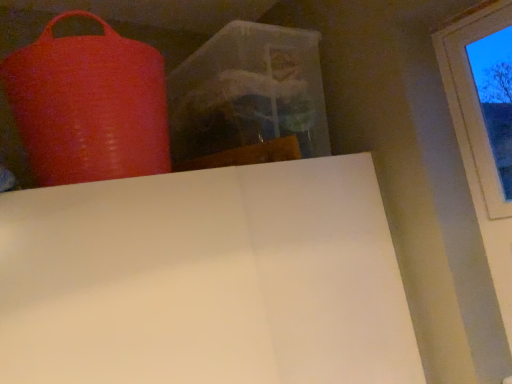
Where is `transparent glass window at upper right`? This screenshot has height=384, width=512. transparent glass window at upper right is located at coordinates (473, 99).

What do you see at coordinates (473, 99) in the screenshot?
I see `transparent glass window at upper right` at bounding box center [473, 99].

You are a GUI agent. You are given a task and a screenshot of the screen. Output one action in this format:
    pyautogui.click(x=<x>, y=<y>)
    Task: Click on the rubberized red punching bag at upper left
    Image resolution: width=512 pixels, height=384 pixels.
    Given the screenshot: What is the action you would take?
    pyautogui.click(x=89, y=105)

This screenshot has height=384, width=512. What do you see at coordinates (89, 105) in the screenshot?
I see `rubberized red punching bag at upper left` at bounding box center [89, 105].

In order to face rubberized red punching bag at upper left, should I rotate leftwards or rightwards?

Rotate your view left by about 20.195°.

Locate an element on the screen. The height and width of the screenshot is (384, 512). transparent glass window at upper right is located at coordinates (473, 99).

Which object is positioned more to the left, transparent glass window at upper right or rubberized red punching bag at upper left?

Positioned to the left is rubberized red punching bag at upper left.

Considering the relative positions of transparent glass window at upper right and rubberized red punching bag at upper left in the image provided, is transparent glass window at upper right behind rubberized red punching bag at upper left?

That is True.

Which point is more forward, (487,15) or (162,118)?

The point (162,118) is more forward.

From the image's perspective, would you say transparent glass window at upper right is positioned over rubberized red punching bag at upper left?

Incorrect, from the image's perspective, transparent glass window at upper right is lower than rubberized red punching bag at upper left.

From a real-world perspective, does transparent glass window at upper right stand above rubberized red punching bag at upper left?

No, from a real-world perspective, transparent glass window at upper right is not over rubberized red punching bag at upper left

Between transparent glass window at upper right and rubberized red punching bag at upper left, which one has larger width?

rubberized red punching bag at upper left.

Considering the relative sizes of transparent glass window at upper right and rubberized red punching bag at upper left in the image provided, is transparent glass window at upper right shorter than rubberized red punching bag at upper left?

In fact, transparent glass window at upper right may be taller than rubberized red punching bag at upper left.

Considering the sizes of transparent glass window at upper right and rubberized red punching bag at upper left in the image, is transparent glass window at upper right bigger or smaller than rubberized red punching bag at upper left?

transparent glass window at upper right is smaller than rubberized red punching bag at upper left.

In the scene shown: Do you think transparent glass window at upper right is within rubberized red punching bag at upper left, or outside of it?

transparent glass window at upper right is not enclosed by rubberized red punching bag at upper left.

Are transparent glass window at upper right and rubberized red punching bag at upper left making contact?

No, transparent glass window at upper right is not with rubberized red punching bag at upper left.

Is transparent glass window at upper right facing towards rubberized red punching bag at upper left?

No, transparent glass window at upper right is not turned towards rubberized red punching bag at upper left.

Where is `punching bag to the left of transparent glass window at upper right`? The image size is (512, 384). punching bag to the left of transparent glass window at upper right is located at coordinates (89, 105).

Is rubberized red punching bag at upper left to the right of transparent glass window at upper right from the viewer's perspective?

In fact, rubberized red punching bag at upper left is to the left of transparent glass window at upper right.

Which object is closer to the camera, rubberized red punching bag at upper left or transparent glass window at upper right?

rubberized red punching bag at upper left is closer to the camera.

Is point (143, 51) positioned after point (463, 40)?

No, (143, 51) is in front of (463, 40).

From the image's perspective, relative to transparent glass window at upper right, is rubberized red punching bag at upper left above or below?

From the image's perspective, rubberized red punching bag at upper left appears above transparent glass window at upper right.

From a real-world perspective, is rubberized red punching bag at upper left over transparent glass window at upper right?

Yes, from a real-world perspective, rubberized red punching bag at upper left is above transparent glass window at upper right.

Looking at their sizes, would you say rubberized red punching bag at upper left is wider or thinner than transparent glass window at upper right?

In the image, rubberized red punching bag at upper left appears to be wider than transparent glass window at upper right.

In terms of height, does rubberized red punching bag at upper left look taller or shorter compared to transparent glass window at upper right?

Considering their sizes, rubberized red punching bag at upper left has less height than transparent glass window at upper right.

Considering the sizes of rubberized red punching bag at upper left and transparent glass window at upper right in the image, is rubberized red punching bag at upper left bigger or smaller than transparent glass window at upper right?

Considering their sizes, rubberized red punching bag at upper left takes up more space than transparent glass window at upper right.

Is rubberized red punching bag at upper left positioned beyond the bounds of transparent glass window at upper right?

rubberized red punching bag at upper left lies outside transparent glass window at upper right's area.

Can you see rubberized red punching bag at upper left touching transparent glass window at upper right?

No, rubberized red punching bag at upper left is not beside transparent glass window at upper right.

Is rubberized red punching bag at upper left facing away from transparent glass window at upper right?

No.

Looking at this image, how different are the orientations of rubberized red punching bag at upper left and transparent glass window at upper right in degrees?

91.9 degrees.

How much distance is there between rubberized red punching bag at upper left and transparent glass window at upper right?

rubberized red punching bag at upper left is 3.79 feet from transparent glass window at upper right.

Identify the location of window on the right side of rubberized red punching bag at upper left. (473, 99).

Find the location of a particular element. The height and width of the screenshot is (384, 512). window that appears below the rubberized red punching bag at upper left (from the image's perspective) is located at coordinates (473, 99).

What are the coordinates of `punching bag lying on the left of transparent glass window at upper right` in the screenshot? It's located at (89, 105).